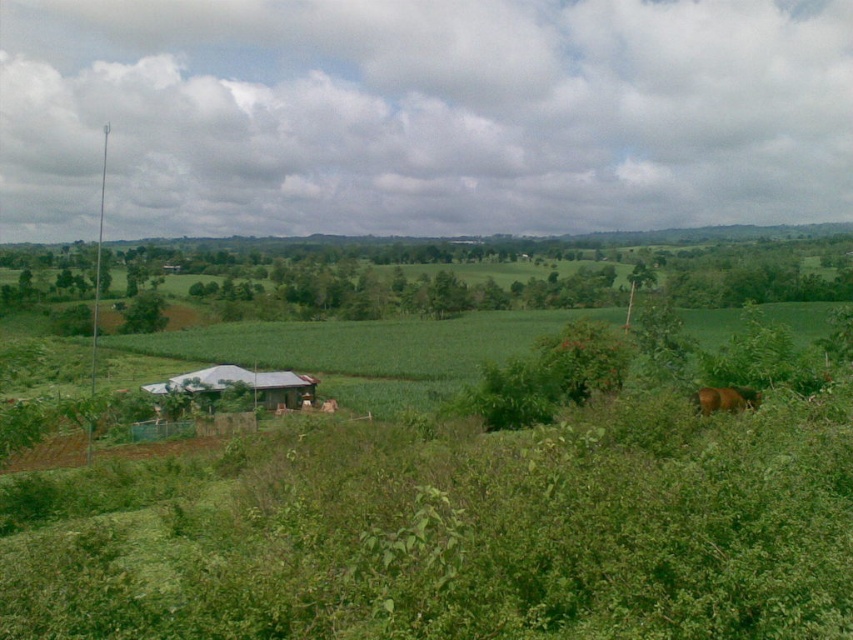
Who is positioned more to the right, metallic gray hut at lower left or brown furry horse at lower right?

From the viewer's perspective, brown furry horse at lower right appears more on the right side.

Can you confirm if metallic gray hut at lower left is smaller than brown furry horse at lower right?

No, metallic gray hut at lower left is not smaller than brown furry horse at lower right.

Which is in front, point (167, 388) or point (730, 406)?

Point (730, 406) is more forward.

This screenshot has width=853, height=640. Identify the location of metallic gray hut at lower left. (241, 385).